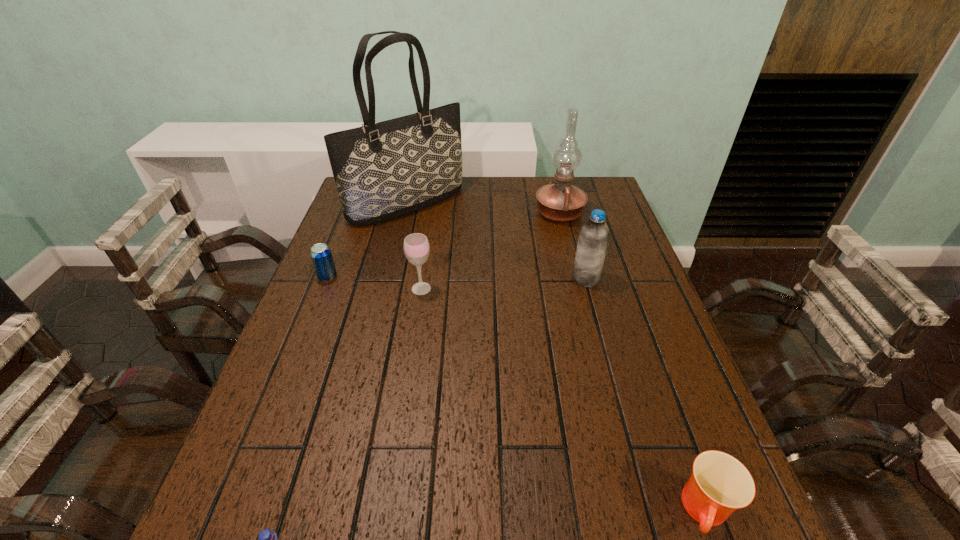
Locate an element on the screen. This screenshot has width=960, height=540. blank space that satisfies the following two spatial constraints: 1. on the front side of the tallest object; 2. on the left side of the oil lamp is located at coordinates (405, 213).

At what (x,y) coordinates should I click in order to perform the action: click on vacant space that satisfies the following two spatial constraints: 1. on the front side of the beer can; 2. on the right side of the wineglass. Please return your answer as a coordinate pair (x, y). Image resolution: width=960 pixels, height=540 pixels. Looking at the image, I should click on (323, 288).